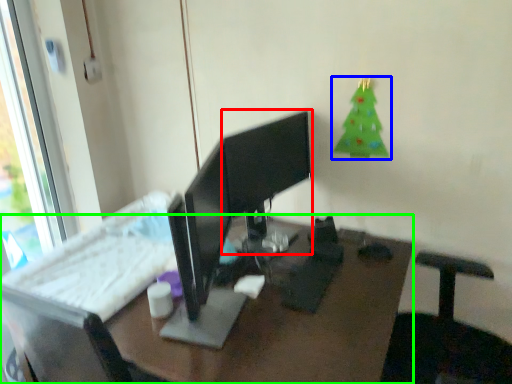
Question: Based on their relative distances, which object is nearer to computer monitor (highlighted by a red box)? Choose from christmas tree (highlighted by a blue box) and desk (highlighted by a green box).

Choices:
 (A) christmas tree
 (B) desk

Answer: (A)